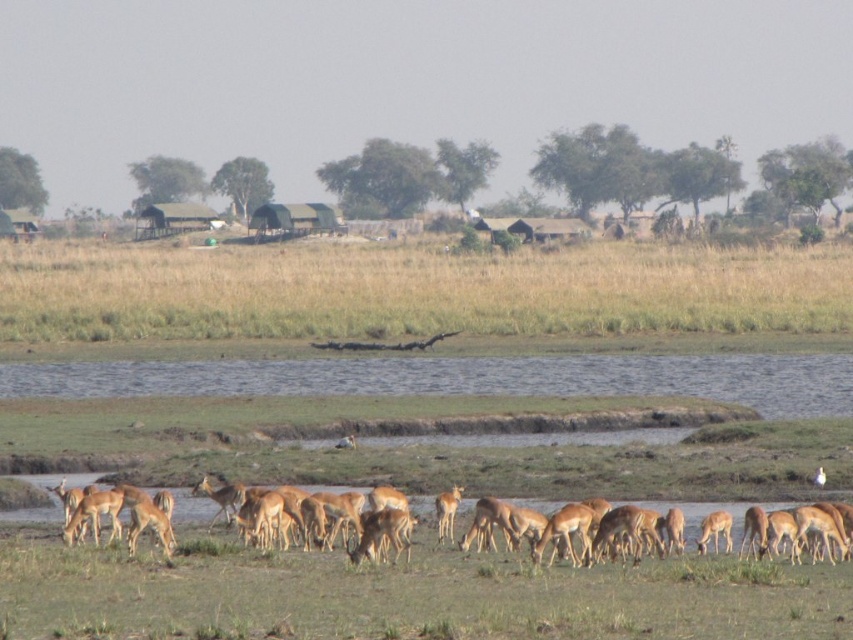
Is point (619, 518) positioned behind point (712, 548)?

No.

Can you confirm if light brown antelope at lower center is taller than brown fur deer at lower right?

Indeed, light brown antelope at lower center has a greater height compared to brown fur deer at lower right.

Where is `light brown antelope at lower center`? light brown antelope at lower center is located at coordinates (596, 531).

Which of these two, dry grass at center or brown fur antelope at center, stands shorter?

brown fur antelope at center is shorter.

How distant is dry grass at center from brown fur antelope at center?

dry grass at center is 47.54 meters from brown fur antelope at center.

This screenshot has width=853, height=640. I want to click on dry grass at center, so click(415, 291).

Is clear water at center taller than brown fur deer at lower right?

Yes.

Who is higher up, clear water at center or brown fur deer at lower right?

clear water at center is above.

I want to click on clear water at center, so (463, 378).